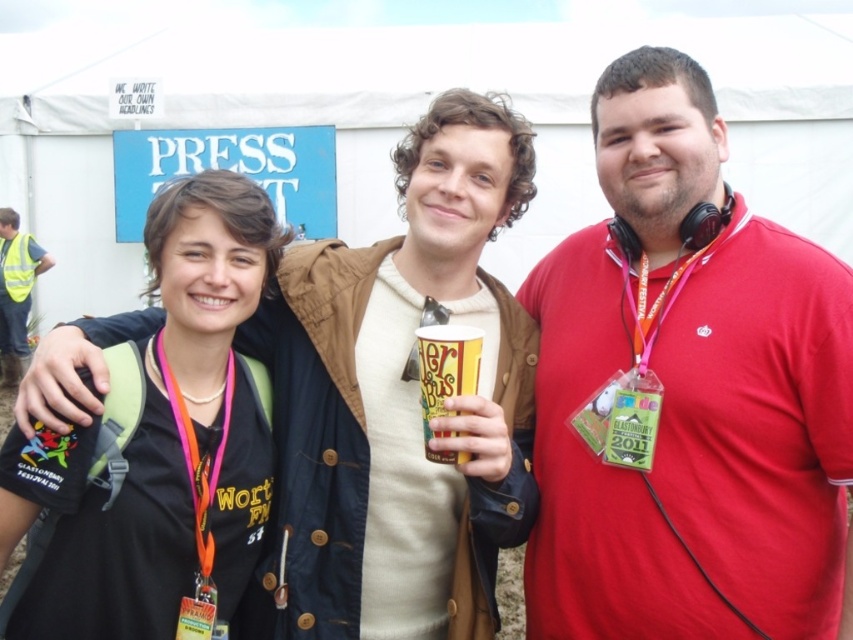
Is point (602, 147) in front of point (428, 112)?

Yes, point (602, 147) is closer to viewer.

Does point (717, 342) come behind point (363, 346)?

No, it is in front of (363, 346).

Where is `red cotton shirt at center`? Image resolution: width=853 pixels, height=640 pixels. red cotton shirt at center is located at coordinates click(689, 394).

Does matte brown jacket at center have a larger size compared to yellow paper cup at center?

Yes.

I want to click on matte brown jacket at center, so click(x=399, y=401).

Image resolution: width=853 pixels, height=640 pixels. What do you see at coordinates (399, 401) in the screenshot? I see `matte brown jacket at center` at bounding box center [399, 401].

Does matte brown jacket at center have a larger size compared to high visibility vest at left?

Yes, matte brown jacket at center is bigger than high visibility vest at left.

Does point (439, 252) come farther from viewer compared to point (19, 323)?

No, (439, 252) is in front of (19, 323).

You are a GUI agent. You are given a task and a screenshot of the screen. Output one action in this format:
    pyautogui.click(x=<x>, y=<y>)
    Task: Click on the matte brown jacket at center
    The image size is (853, 640).
    Given the screenshot: What is the action you would take?
    (x=399, y=401)